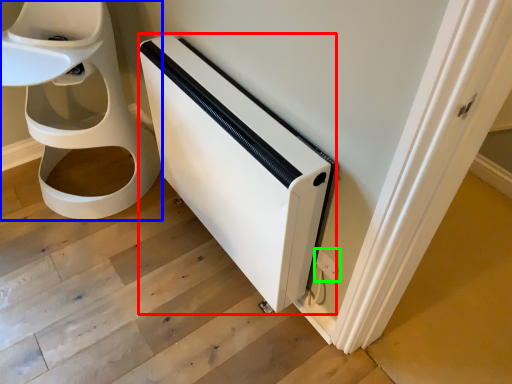
Question: Which object is positioned farthest from appliance (highlighted by a red box)? Select from toilet (highlighted by a blue box) and electric outlet (highlighted by a green box).

Choices:
 (A) toilet
 (B) electric outlet

Answer: (A)